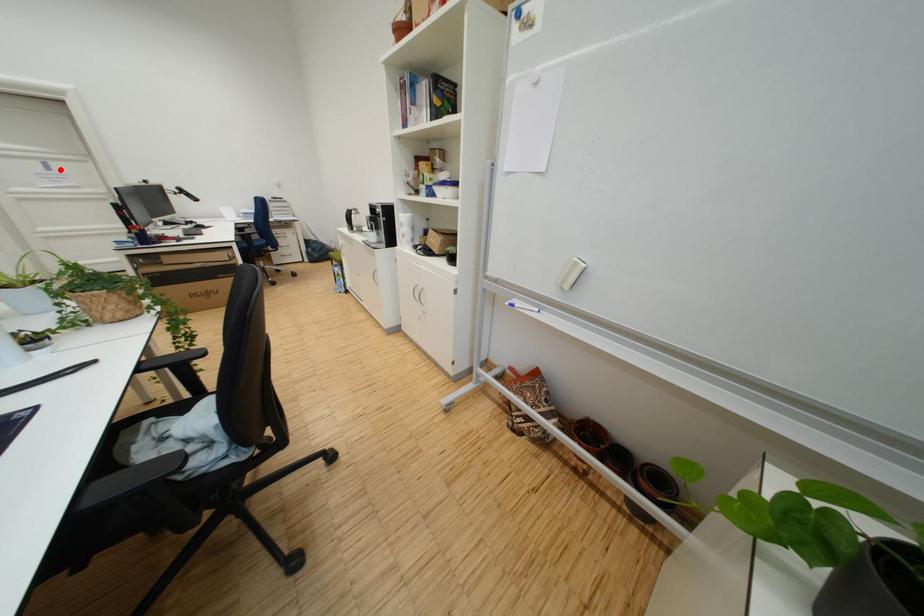
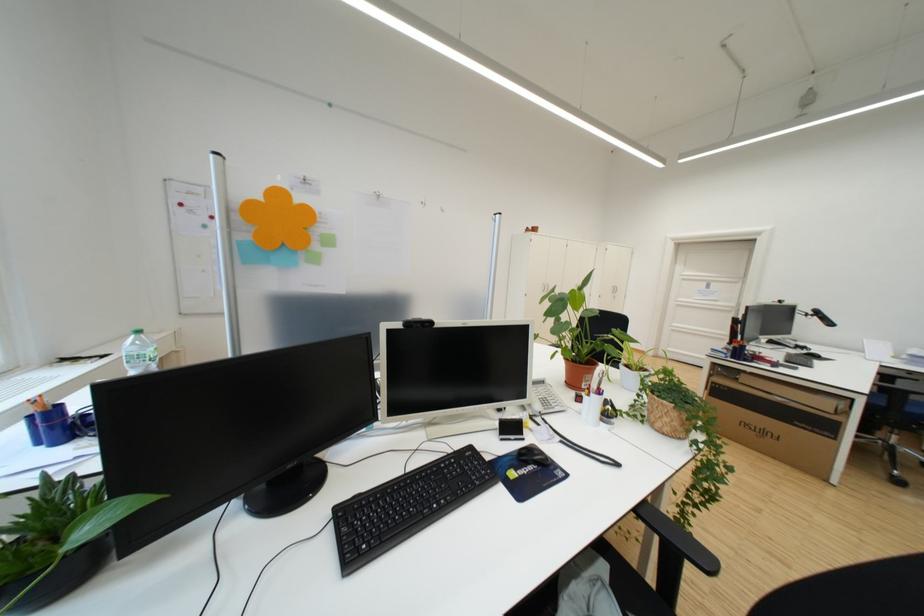
Question: I am providing you with two images of the same scene from different viewpoints. Image1 has a red point marked. In image2, the corresponding 3D location appears at what relative position? Reply with the corresponding letter.

Choices:
 (A) Closer
 (B) Farther

Answer: (A)